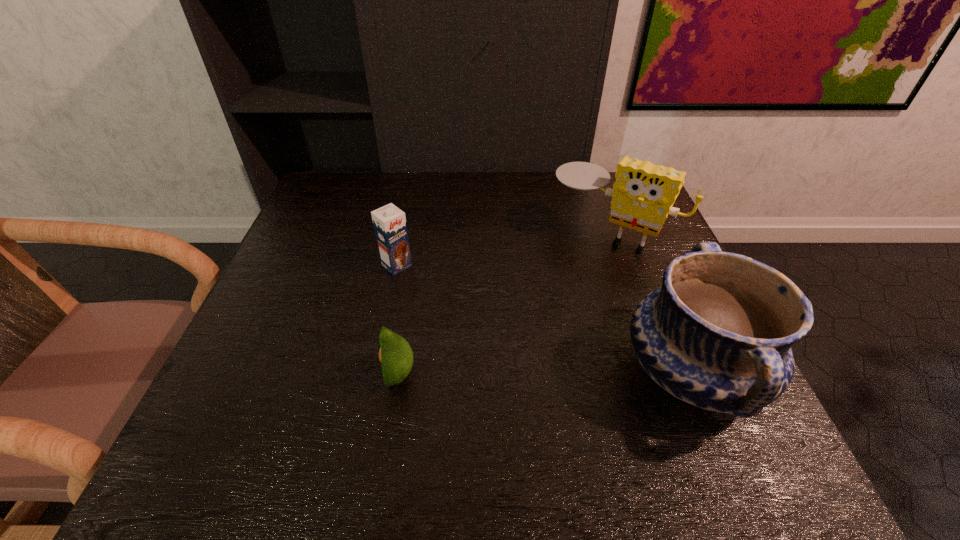
At what (x,y) coordinates should I click in order to perform the action: click on the shortest object. Please return your answer as a coordinate pair (x, y). This screenshot has height=540, width=960. Looking at the image, I should click on (395, 354).

Identify the location of pottery. (718, 334).

Find the location of a particular element. Image resolution: width=960 pixels, height=540 pixels. sponge is located at coordinates (643, 194).

Where is `chocolate milk`? chocolate milk is located at coordinates (389, 222).

Identify the location of free location located on the cut side of the avocado. Image resolution: width=960 pixels, height=540 pixels. (286, 374).

Where is `free space located 0.160m on the cut side of the avocado`? free space located 0.160m on the cut side of the avocado is located at coordinates (298, 374).

Where is `free region located 0.150m on the cut side of the avocado`? The height and width of the screenshot is (540, 960). free region located 0.150m on the cut side of the avocado is located at coordinates (302, 374).

Where is `vacant region located 0.220m on the back of the pottery`? Image resolution: width=960 pixels, height=540 pixels. vacant region located 0.220m on the back of the pottery is located at coordinates coord(638,246).

Identify the location of vacant space located 0.200m on the front-facing side of the sponge. (546, 309).

The height and width of the screenshot is (540, 960). What are the coordinates of `blank area located on the front-facing side of the sponge` in the screenshot? It's located at (574, 272).